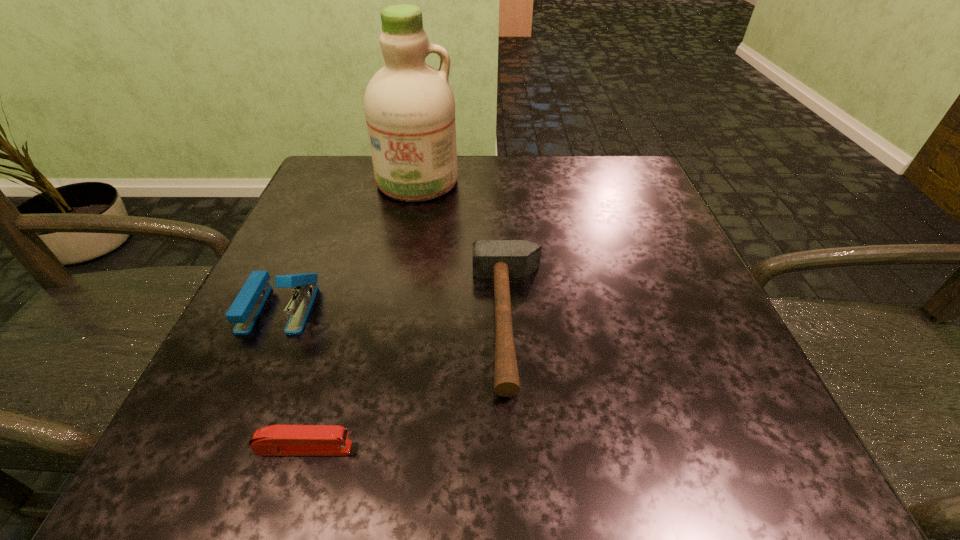
In the image, there is a desktop. Identify the location of vacant space at the near edge. This screenshot has width=960, height=540. (507, 468).

In the image, there is a desktop. Identify the location of free region at the left edge. The width and height of the screenshot is (960, 540). (302, 224).

I want to click on vacant space at the right edge of the desktop, so click(x=690, y=268).

Where is `vacant space at the far left corner of the desktop`? vacant space at the far left corner of the desktop is located at coordinates (371, 200).

In the image, there is a desktop. Identify the location of vacant space at the far right corner. This screenshot has height=540, width=960. pyautogui.click(x=610, y=196).

The width and height of the screenshot is (960, 540). I want to click on blank space at the near right corner of the desktop, so click(x=705, y=411).

Identify the location of free space between the nearer stapler and the farther stapler. (292, 378).

You are a GUI agent. You are given a task and a screenshot of the screen. Output one action in this format:
    pyautogui.click(x=<x>, y=<y>)
    Task: Click on the free space between the farthest object and the shorter stapler
    Image resolution: width=960 pixels, height=540 pixels.
    Given the screenshot: What is the action you would take?
    pyautogui.click(x=361, y=315)

Locate an element on the screen. The image size is (960, 540). empty space between the shorter stapler and the tallest object is located at coordinates (361, 315).

The width and height of the screenshot is (960, 540). Find the location of `vacant space in between the shorter stapler and the rightmost object`. vacant space in between the shorter stapler and the rightmost object is located at coordinates (407, 384).